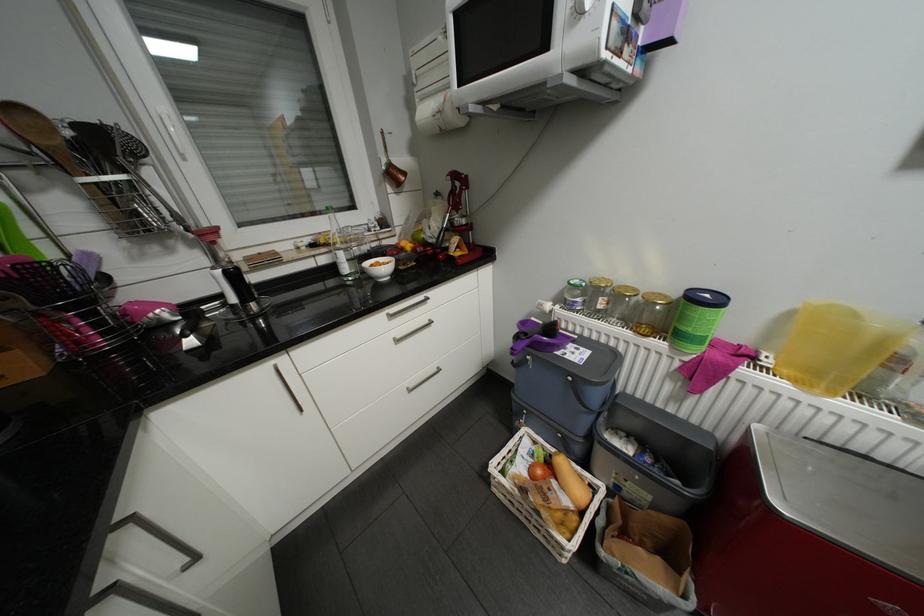
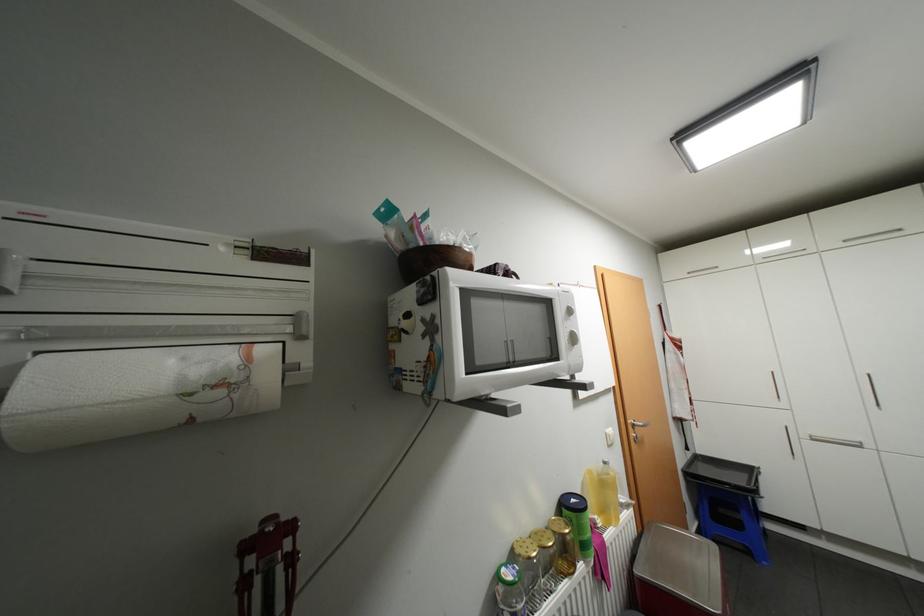
Where in the second image is the point corresponding to (690,317) from the first image?

(589, 528)